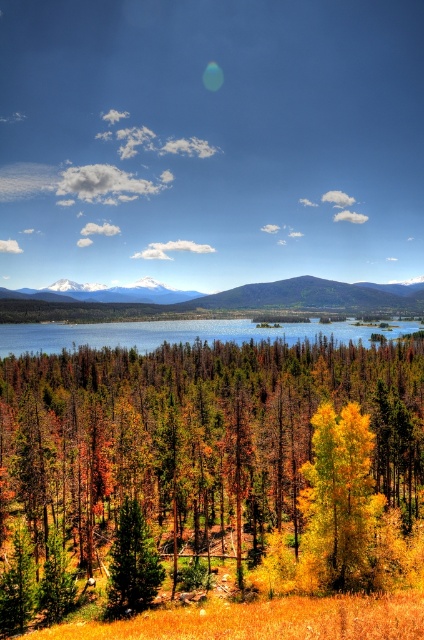
Between point (88, 564) and point (120, 608), which one is positioned in front?

Positioned in front is point (120, 608).

Between yellow-green leaves at center and green matte tree at center, which one appears on the left side from the viewer's perspective?

Positioned to the left is yellow-green leaves at center.

Does point (155, 456) come closer to viewer compared to point (130, 593)?

No, (155, 456) is further to viewer.

You are a GUI agent. You are given a task and a screenshot of the screen. Output one action in this format:
    pyautogui.click(x=<x>, y=<y>)
    Task: Click on the yellow-green leaves at center
    
    Given the screenshot: What is the action you would take?
    pyautogui.click(x=209, y=477)

Which is behind, point (367, 554) or point (349, 321)?

Point (349, 321)

Is the position of yellow matte tree at center less distant than that of clear blue water at center?

Yes.

Between point (351, 406) and point (148, 326), which one is positioned behind?

Positioned behind is point (148, 326).

Locate an element on the screen. This screenshot has width=424, height=640. yellow matte tree at center is located at coordinates (340, 500).

Can you confirm if green matte tree at center is positioned to the right of snowy peak at center?

Correct, you'll find green matte tree at center to the right of snowy peak at center.

Is green matte tree at center behind snowy peak at center?

No, it is not.

What are the coordinates of `green matte tree at center` in the screenshot? It's located at (131, 564).